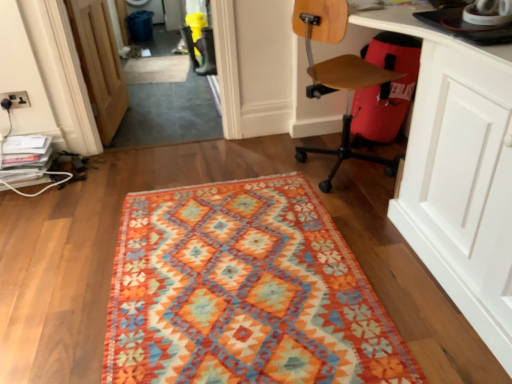
Image resolution: width=512 pixels, height=384 pixels. What are the coordinates of `free space in front of wooden at right` in the screenshot? It's located at (371, 211).